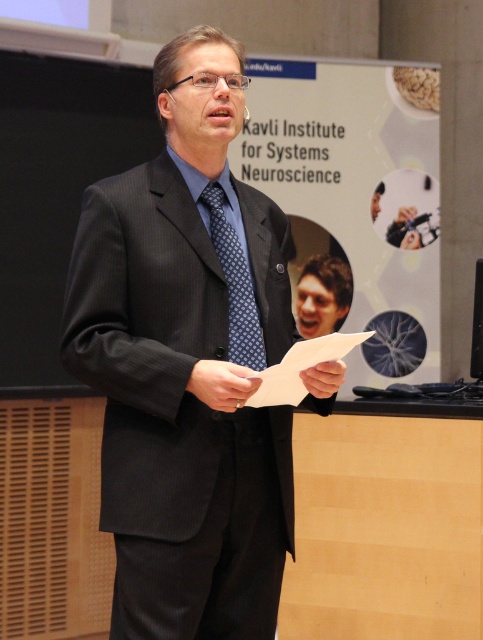
You are an event planner organizing a presentation and need to place a small microphone stand. The stand must be positioned exactly at the point with coordinates point (235, 284). Where should you place the microphone stand?

The point (235, 284) is located on the blue dotted tie at center, so you should place the microphone stand there.

The man in the image is giving a presentation. He needs to adjust his blue dotted tie at center so it doesn not cover his brown hair at center. Based on their positions, is this adjustment necessary?

The blue dotted tie at center is in front of brown hair at center, so it is already covering part of the hair. The man should adjust his tie to prevent it from covering his hair.